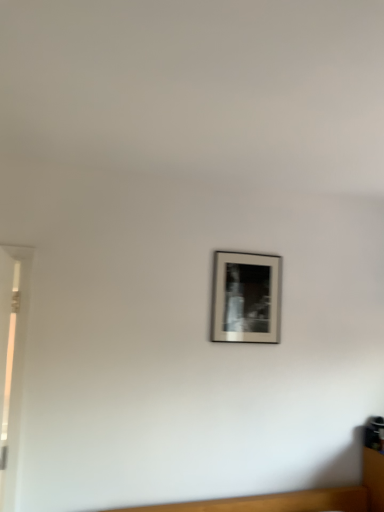
What do you see at coordinates (246, 297) in the screenshot? I see `silver metallic picture frame at center` at bounding box center [246, 297].

You are a GUI agent. You are given a task and a screenshot of the screen. Output one action in this format:
    pyautogui.click(x=<x>, y=<y>)
    Task: Click on the silver metallic picture frame at center
    
    Given the screenshot: What is the action you would take?
    pyautogui.click(x=246, y=297)

Locate an element on the screen. This screenshot has width=384, height=512. silver metallic picture frame at center is located at coordinates (246, 297).